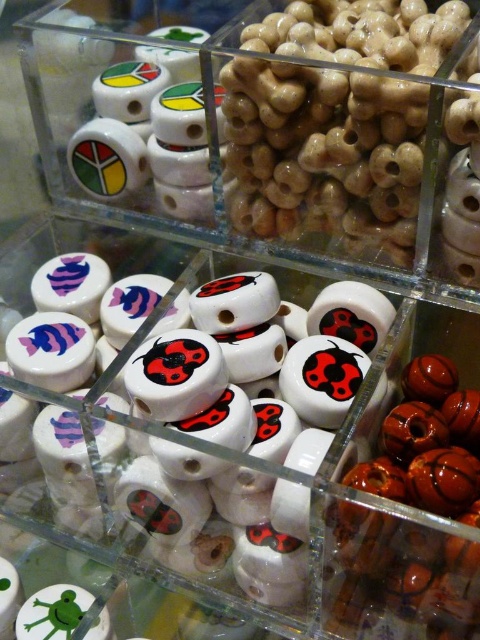
You are an artisan creating a necklace and have two types of beads available. You have the white glossy beads at center and the white glossy bead at center. Which bead type should you choose if you want to create a necklace with larger beads?

You should choose the white glossy beads at center because they are larger in size than the white glossy bead at center.

You are an artisan creating a necklace and have two options for beads. You need to choose between the white glossy beads at center and the white glossy bead at center. Which one is wider?

The white glossy beads at center are wider than the white glossy bead at center.